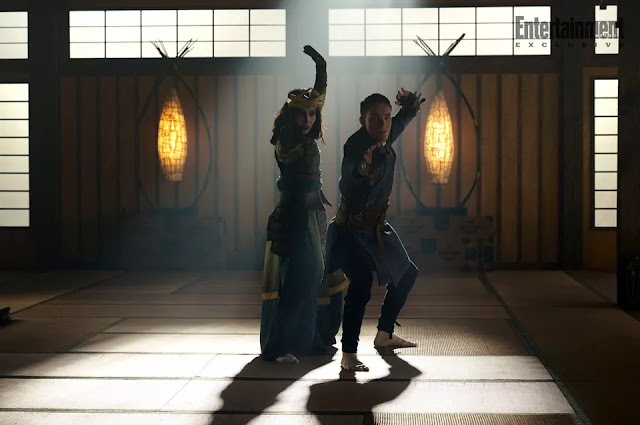
Where is `tile floor`? Image resolution: width=640 pixels, height=425 pixels. tile floor is located at coordinates (139, 338).